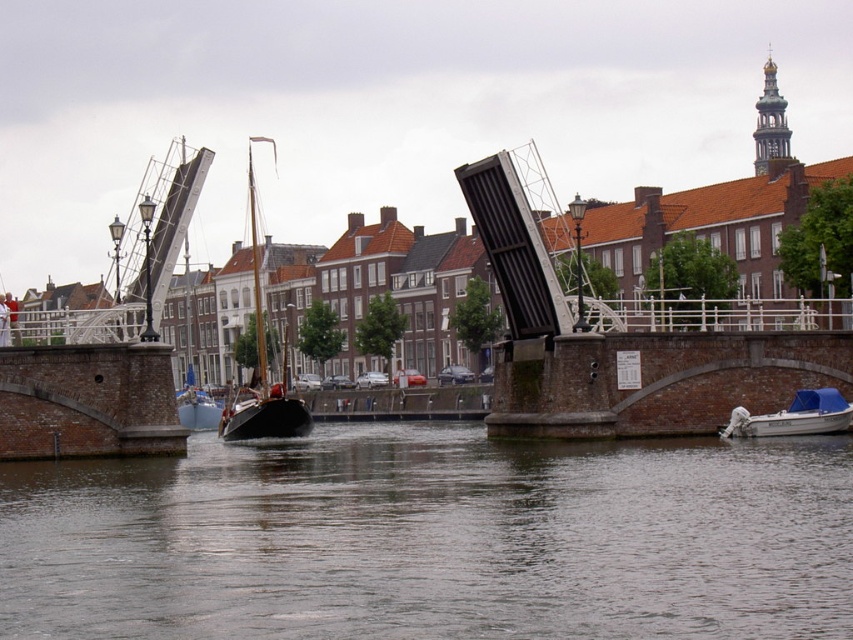
You are a tour guide explaining the canal scene to visitors. Point out the exact location of the wooden sailboat at center using coordinates. What are its coordinates?

The wooden sailboat at center is located at coordinates point (262, 360).

You are a tourist standing on the raised drawbridge and want to take a photo of the smooth water at center and the white plastic boat at lower right. Which object should you focus on first if you want to capture both in a single frame without moving your camera?

The smooth water at center has a larger size compared to the white plastic boat at lower right, so you should focus on the white plastic boat at lower right first to ensure it is in sharp focus while the larger water area will naturally be in focus as well due to its size.